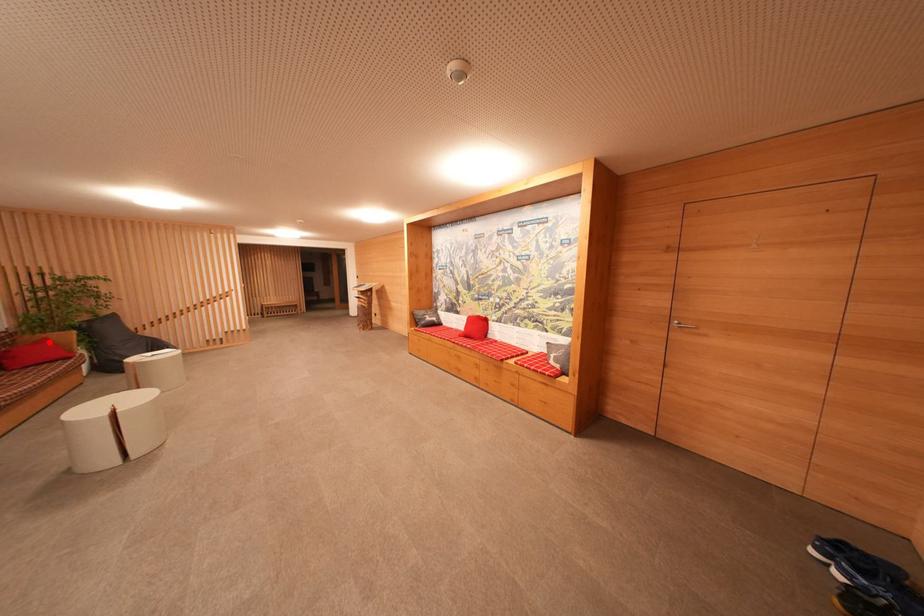
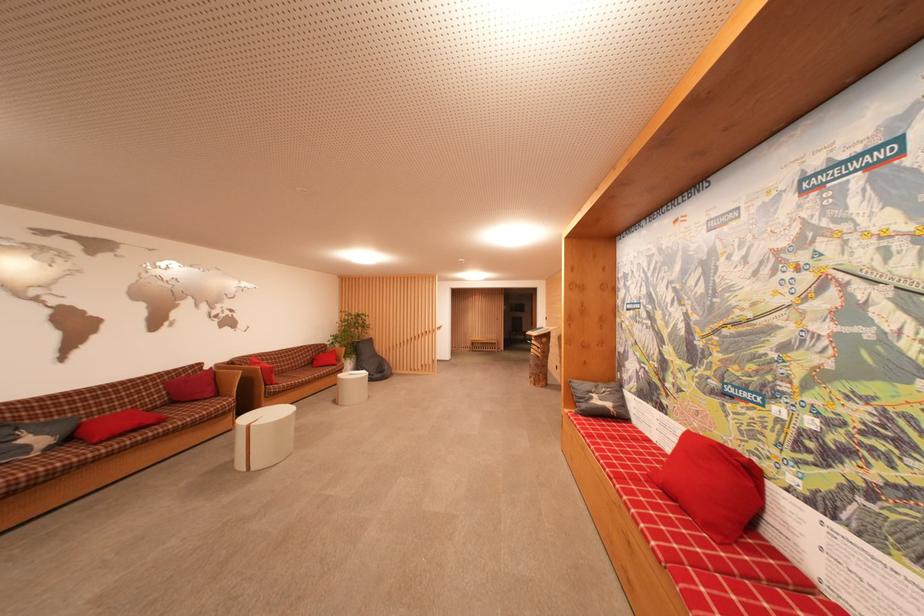
Where in the second image is the point corresponding to the highlighted location from the first image?

(338, 354)